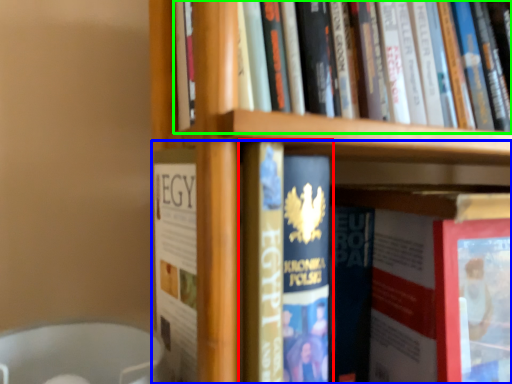
Question: Estimate the real-world distances between objects in this image. Which object is closer to book (highlighted by a red box), book (highlighted by a blue box) or book (highlighted by a green box)?

Choices:
 (A) book
 (B) book

Answer: (A)